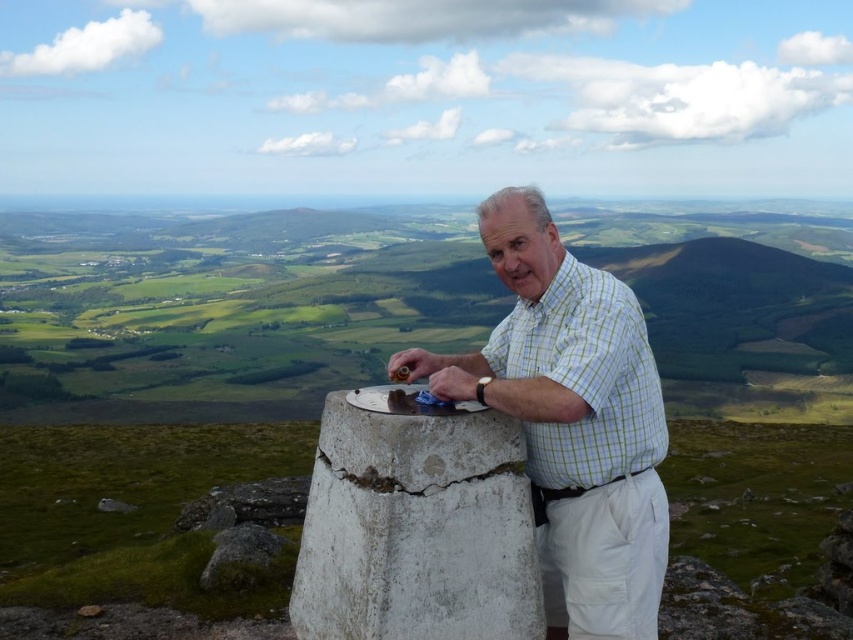
You are a photographer trying to capture the man in the green checkered shirt at center while ensuring the white cracked cement at center is also visible in the frame. Given their sizes, which object should you focus on first to ensure both are in the frame?

The white cracked cement at center occupies less space than the green checkered shirt at center, so you should focus on the white cracked cement at center first to ensure it is in the frame while the larger green checkered shirt at center will naturally be included.